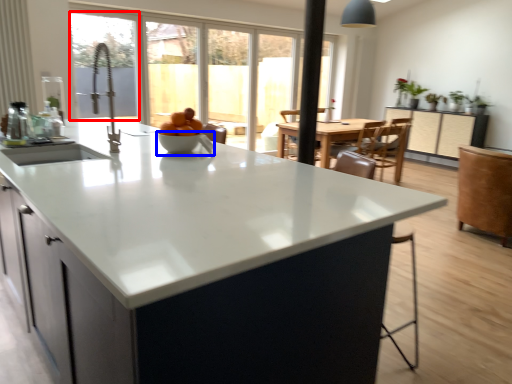
Question: Which point is closer to the camera, window screen (highlighted by a red box) or bowl (highlighted by a blue box)?

Choices:
 (A) window screen
 (B) bowl

Answer: (A)